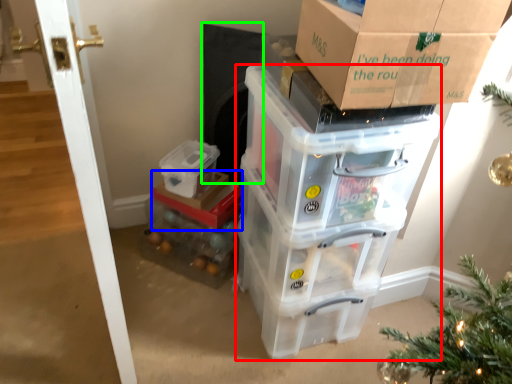
Question: Which is farther away from storage box (highlighted by a red box)? storage box (highlighted by a blue box) or appliance (highlighted by a green box)?

Choices:
 (A) storage box
 (B) appliance

Answer: (B)